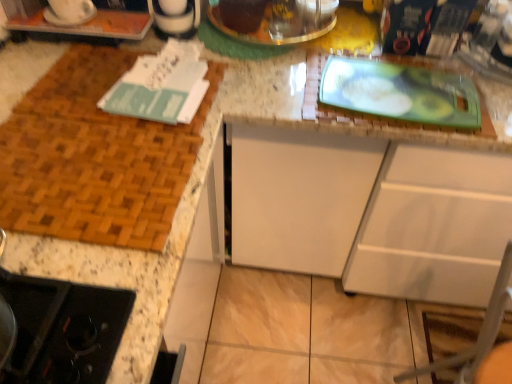
Question: Should I look upward or downward to see white glossy coffee maker at upper left, the 2th appliance positioned from the right?

Choices:
 (A) down
 (B) up

Answer: (B)

Question: Is metallic silver pot at upper center, which appears as the 2th appliance when viewed from the front, wider than white glossy coffee maker at upper left, the 2th appliance positioned from the right?

Choices:
 (A) yes
 (B) no

Answer: (A)

Question: Is metallic silver pot at upper center, the 1th appliance in the right-to-left sequence, in contact with white glossy coffee maker at upper left, placed as the 2th appliance when sorted from back to front?

Choices:
 (A) yes
 (B) no

Answer: (B)

Question: Is metallic silver pot at upper center, arranged as the second appliance when viewed from the left, positioned with its back to white glossy coffee maker at upper left, the 2th appliance positioned from the right?

Choices:
 (A) yes
 (B) no

Answer: (B)

Question: From a real-world perspective, does metallic silver pot at upper center, the 1th appliance in the right-to-left sequence, sit lower than white glossy coffee maker at upper left, the 2th appliance positioned from the right?

Choices:
 (A) yes
 (B) no

Answer: (A)

Question: Does metallic silver pot at upper center, arranged as the second appliance when viewed from the left, appear on the left side of white glossy coffee maker at upper left, the 2th appliance positioned from the right?

Choices:
 (A) no
 (B) yes

Answer: (A)

Question: Is metallic silver pot at upper center, the 1th appliance in the right-to-left sequence, bigger than white glossy coffee maker at upper left, the 2th appliance positioned from the right?

Choices:
 (A) yes
 (B) no

Answer: (A)

Question: Can you confirm if white glossy coffee maker at upper left, the 2th appliance positioned from the right, is taller than white matte cabinet at center?

Choices:
 (A) yes
 (B) no

Answer: (B)

Question: Would you consider white glossy coffee maker at upper left, acting as the 1th appliance starting from the left, to be distant from white matte cabinet at center?

Choices:
 (A) no
 (B) yes

Answer: (A)

Question: From a real-world perspective, is white glossy coffee maker at upper left, placed as the first appliance when sorted from front to back, positioned under white matte cabinet at center based on gravity?

Choices:
 (A) no
 (B) yes

Answer: (A)

Question: Is white glossy coffee maker at upper left, acting as the 1th appliance starting from the left, in contact with white matte cabinet at center?

Choices:
 (A) no
 (B) yes

Answer: (A)

Question: Is white glossy coffee maker at upper left, acting as the 1th appliance starting from the left, wider than white matte cabinet at center?

Choices:
 (A) yes
 (B) no

Answer: (B)

Question: Is the position of white glossy coffee maker at upper left, placed as the first appliance when sorted from front to back, more distant than that of white matte cabinet at center?

Choices:
 (A) yes
 (B) no

Answer: (A)

Question: Is white matte cabinet at center to the left of white glossy coffee maker at upper left, placed as the first appliance when sorted from front to back, from the viewer's perspective?

Choices:
 (A) yes
 (B) no

Answer: (B)